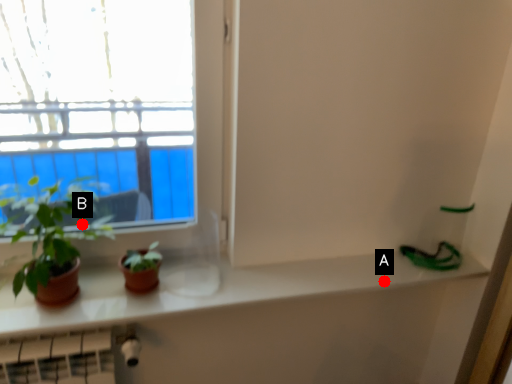
Question: Two points are circled on the image, labeled by A and B beside each circle. Among these points, which one is farthest from the camera?

Choices:
 (A) A is further
 (B) B is further

Answer: (A)